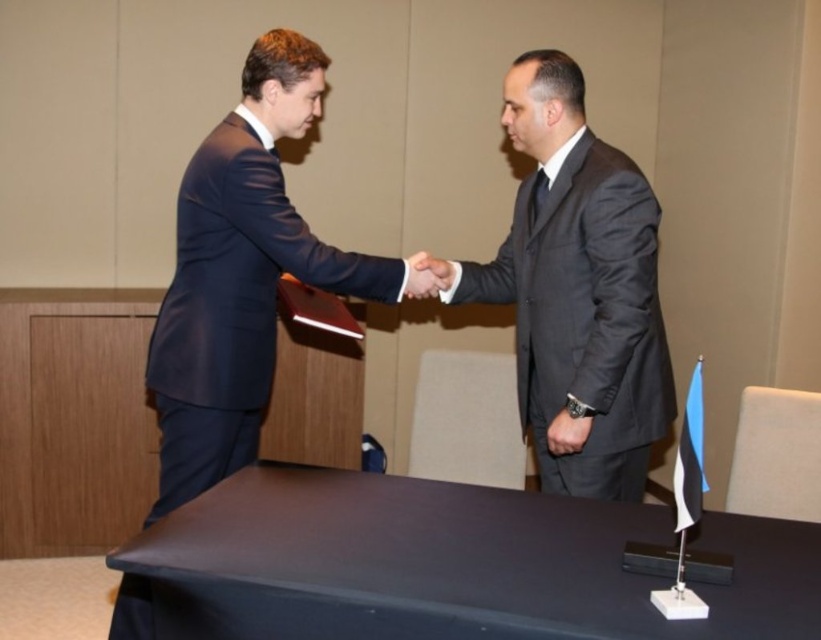
Can you confirm if black matte table at center is taller than black leather wristwatch at center?

Yes, black matte table at center is taller than black leather wristwatch at center.

Who is more distant from viewer, [627,532] or [553,422]?

The point [553,422] is more distant.

Locate an element on the screen. black matte table at center is located at coordinates (446, 564).

Is black matte table at center taller than matte black hand at center?

Yes, black matte table at center is taller than matte black hand at center.

Does point (187, 568) come behind point (423, 266)?

That is False.

Locate an element on the screen. black matte table at center is located at coordinates (446, 564).

Is point (468, 486) less distant than point (613, 220)?

Yes, point (468, 486) is closer to viewer.

Measure the distance between point [785,637] and camera.

The distance of point [785,637] from camera is 1.25 meters.

I want to click on black matte table at center, so click(446, 564).